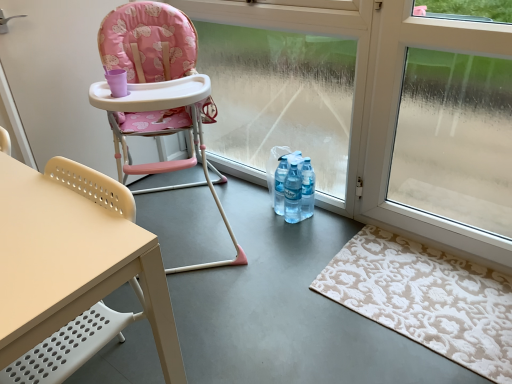
Locate an element on the screen. This screenshot has height=384, width=512. free space that is in between transparent glass window at lower right and translucent plastic bottles at center is located at coordinates (364, 238).